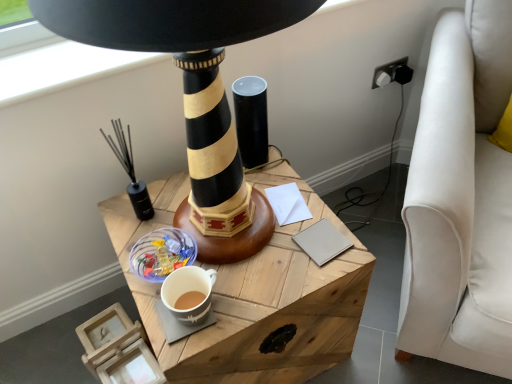
Image resolution: width=512 pixels, height=384 pixels. Find the location of `free location in front of beige leather notepad at center, placed as the 1th notepad when sorted from front to back`. free location in front of beige leather notepad at center, placed as the 1th notepad when sorted from front to back is located at coordinates (312, 279).